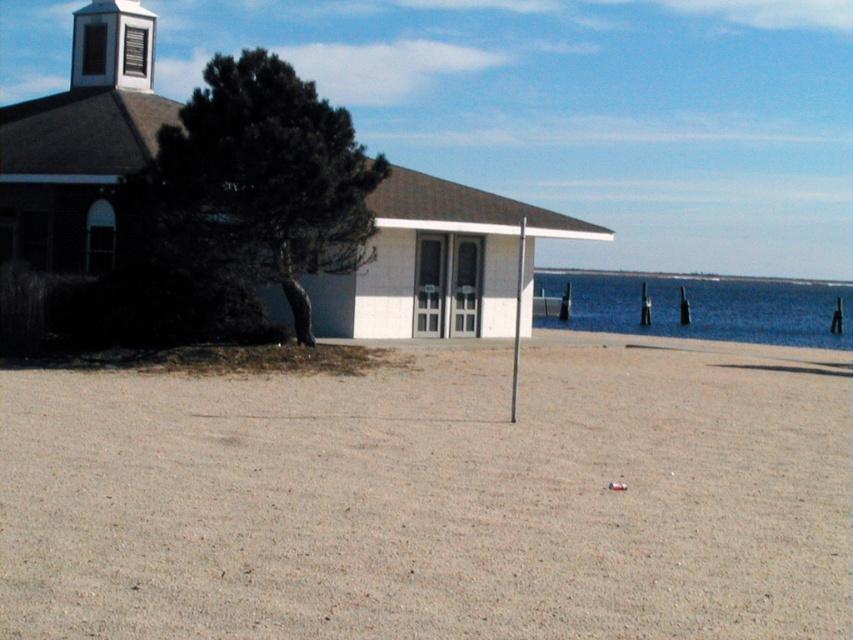
You are standing at the beach and see the brown sandy dirt at center and the blue water at lower right. Which one is lower in height?

The brown sandy dirt at center is shorter than the blue water at lower right, so the brown sandy dirt at center is lower in height.